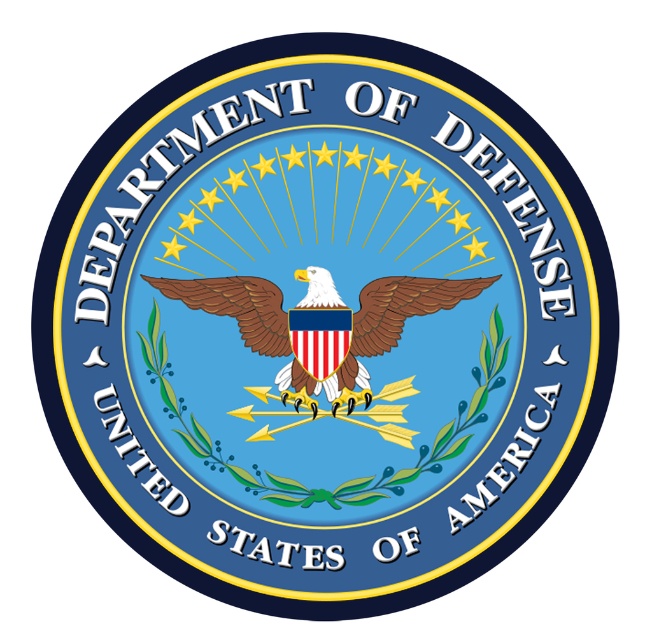
You are examining the Department of Defense seal and notice two points marked on it. The first point is at coordinates point [359,300] and the second is at point [520,429]. Based on their positions, which point is closer to you?

Point [359,300] is closer to the viewer than point [520,429].

You are examining the Department of Defense seal and notice two blue texts. The blue matte text at lower right and the blue glossy text at center. Which one do you think is bigger?

The blue matte text at lower right is larger in size than the blue glossy text at center.

You are examining the Department of Defense seal and notice two texts. The first is the blue matte text at lower right, and the second is the blue glossy text at center. Which text has a greater height?

The blue matte text at lower right is taller than the blue glossy text at center.